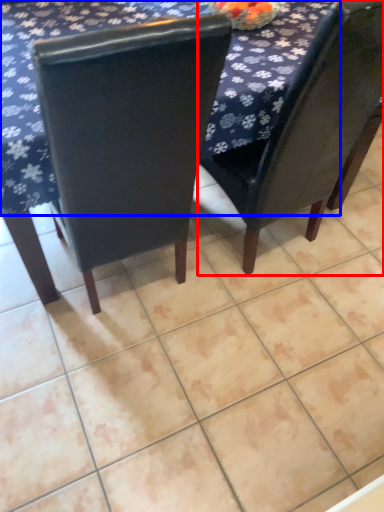
Question: Which point is closer to the camera, chair (highlighted by a red box) or tablecloth (highlighted by a blue box)?

Choices:
 (A) chair
 (B) tablecloth

Answer: (A)